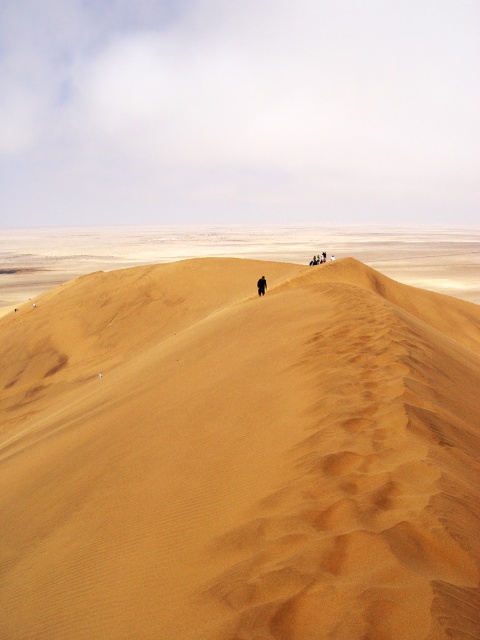
Can you confirm if sandy yellow dune at center is shorter than brown textured sand dune at upper center?

Incorrect, sandy yellow dune at center's height does not fall short of brown textured sand dune at upper center's.

Which of these two, sandy yellow dune at center or brown textured sand dune at upper center, stands taller?

With more height is sandy yellow dune at center.

Is point (116, 534) closer to camera compared to point (257, 288)?

Yes, point (116, 534) is closer to viewer.

At what (x,y) coordinates should I click in order to perform the action: click on sandy yellow dune at center. Please return your answer as a coordinate pair (x, y). This screenshot has width=480, height=640. Looking at the image, I should click on (240, 456).